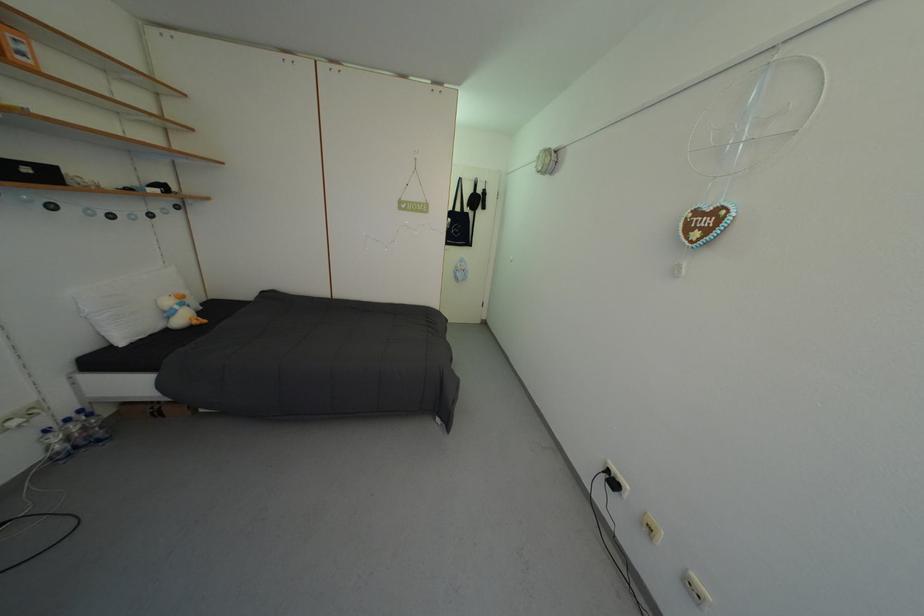
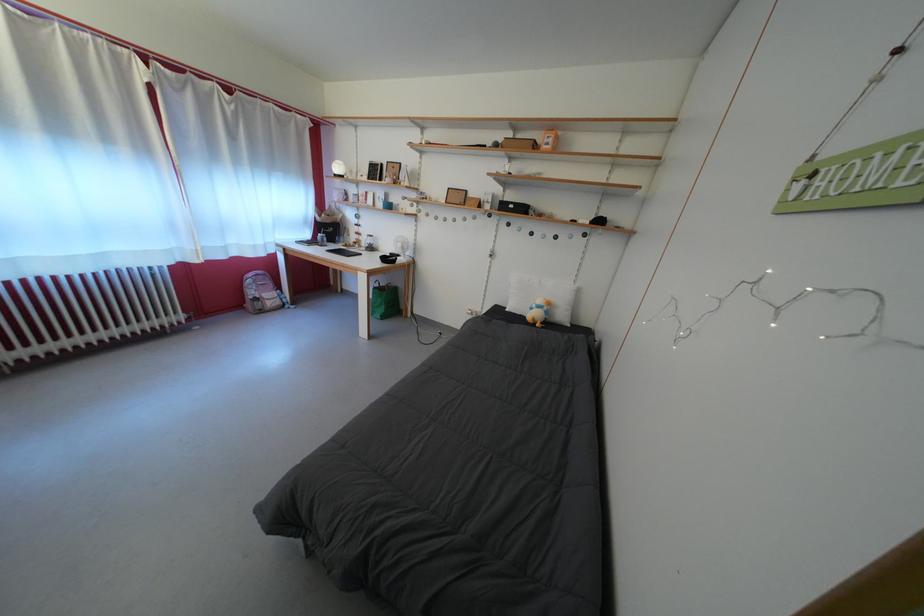
In the second image, find the point that corresponds to [35,176] in the first image.

(519, 213)